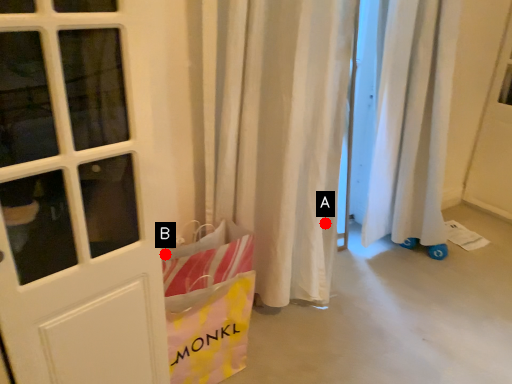
Question: Two points are circled on the image, labeled by A and B beside each circle. Which point is farther from the camera taking this photo?

Choices:
 (A) A is further
 (B) B is further

Answer: (A)